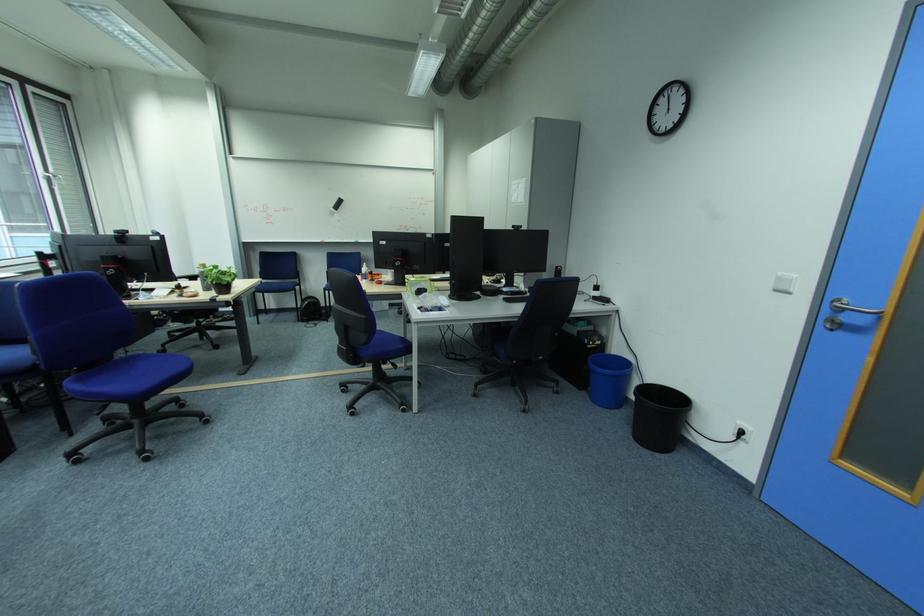
This screenshot has height=616, width=924. I want to click on white light switch, so click(784, 283).